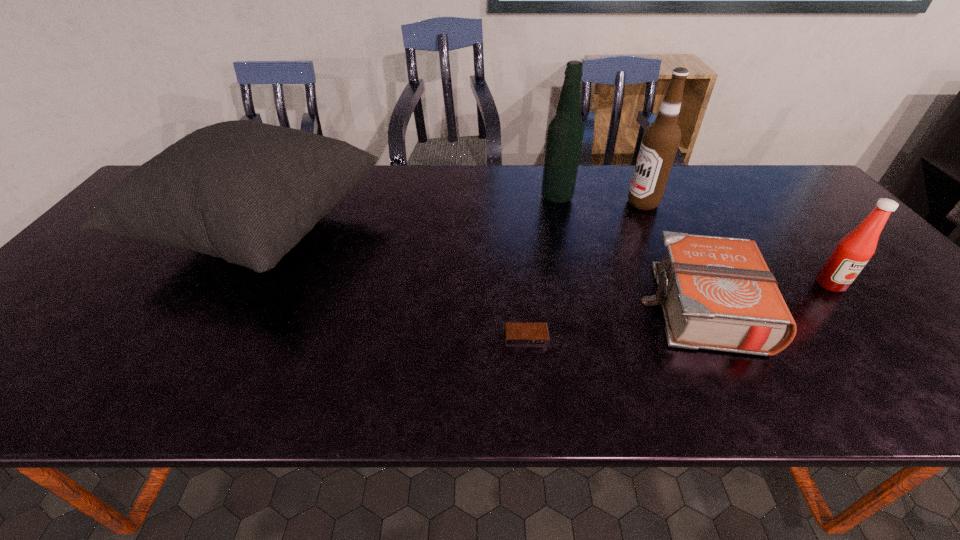
This screenshot has height=540, width=960. What are the coordinates of `vacant space located on the label of the right alcohol` in the screenshot? It's located at (540, 203).

Image resolution: width=960 pixels, height=540 pixels. I want to click on vacant area situated on the label of the right alcohol, so click(529, 203).

Where is `vacant region located on the label of the right alcohol`? Image resolution: width=960 pixels, height=540 pixels. vacant region located on the label of the right alcohol is located at coordinates (495, 203).

The image size is (960, 540). In order to click on free region located on the right of the third tallest object in this screenshot , I will do `click(509, 232)`.

Where is `vacant space located 0.250m on the front-facing side of the condiment`? vacant space located 0.250m on the front-facing side of the condiment is located at coordinates (915, 386).

Where is `free space located 0.160m on the back of the Bible`? free space located 0.160m on the back of the Bible is located at coordinates (663, 227).

Locate an element on the screen. Image resolution: width=960 pixels, height=540 pixels. free space located 0.120m on the front face of the shortest object is located at coordinates (532, 397).

Where is `cushion that is at the far edge`? The height and width of the screenshot is (540, 960). cushion that is at the far edge is located at coordinates (248, 192).

You are a GUI agent. You are given a task and a screenshot of the screen. Output one action in this format:
    pyautogui.click(x=<x>, y=<y>)
    Task: Click on the object that is at the left edge
    This screenshot has width=960, height=540.
    Given the screenshot: What is the action you would take?
    pyautogui.click(x=248, y=192)

This screenshot has height=540, width=960. Find the location of `object that is positioned at the right edge`. object that is positioned at the right edge is located at coordinates (853, 251).